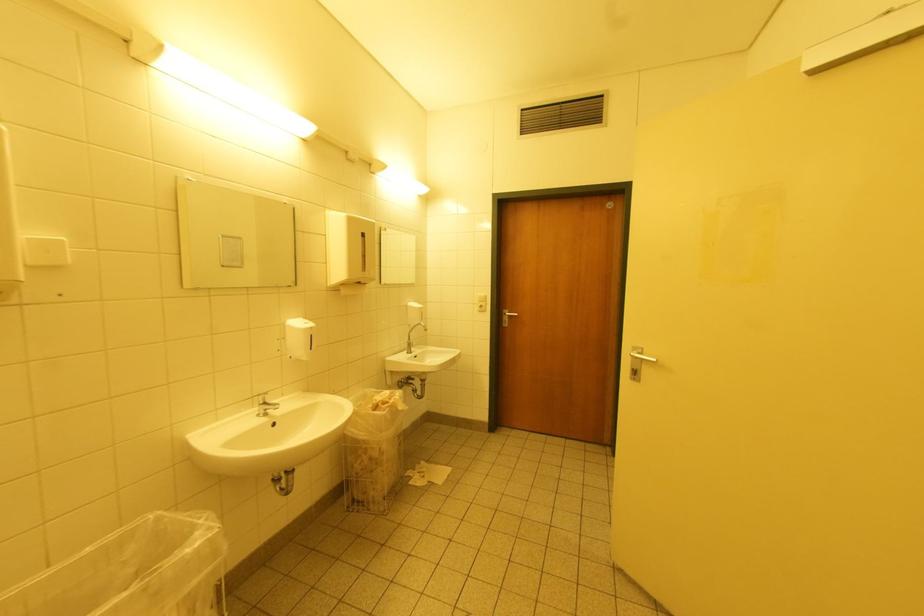
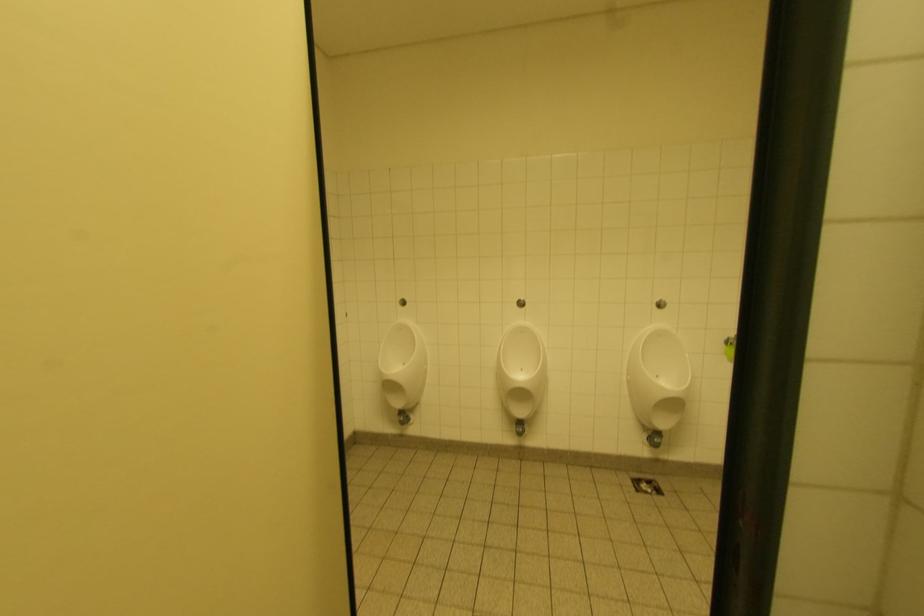
Question: In a continuous first-person perspective shot, in which direction is the camera moving?

Choices:
 (A) Left
 (B) Right
 (C) Forward
 (D) Backward

Answer: (B)